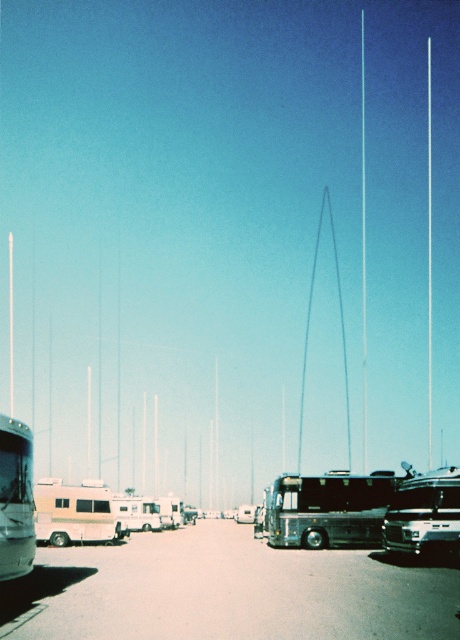
You are a delivery person needing to park a new van that requires a space taller than the shiny black bus at center. The parking lot has spaces between the vertical poles in the background. Can the space between the poles accommodate the van if it is the same height as the silver metallic bus at center?

The shiny black bus at center is shorter than the silver metallic bus at center. Since the van is the same height as the silver metallic bus at center, which is taller than the shiny black bus at center, the space between the poles should be sufficient to accommodate the van.

You are a driver looking to park your car in the parking lot. You see the metallic silver bus at center and the metallic silver car at center. Which vehicle should you avoid parking behind to ensure your view isn???t blocked?

You should avoid parking behind the metallic silver bus at center because it is shorter than the metallic silver car at center, meaning the car might block your view more effectively.

You are a delivery person needing to park a large truck in the parking lot. You see the shiny black bus at center and the beige vinyl camper at center. Which vehicle should you avoid parking next to if you need more space due to the truck size?

You should avoid parking next to the beige vinyl camper at center because it is larger in size compared to the shiny black bus at center, requiring more space.